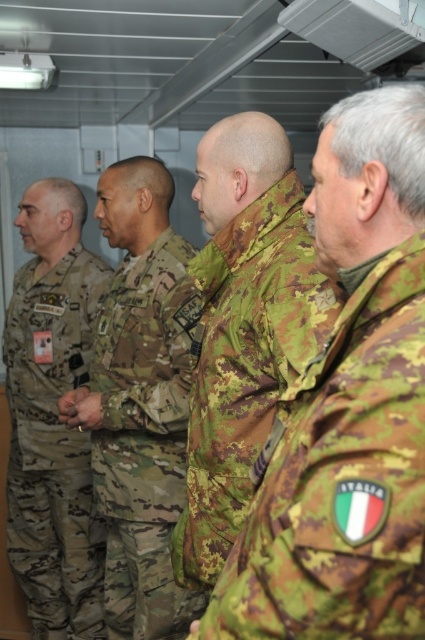
You are a photographer trying to capture a clear photo of the camouflage uniform at center and the camouflage fabric jacket at center. Since both are at the center, which one is blocking the view of the other?

The camouflage fabric jacket at center is behind camouflage uniform at center, so the camouflage uniform at center is blocking the view of the camouflage fabric jacket at center.

You are a photographer setting up a tripod to take a group photo of the four individuals. The tripod has a limited range and can only focus on objects within a 0.5 unit radius centered at point 0.5, 0.5. Will the camouflage fabric jacket at center be within the focus range of the tripod?

The camouflage fabric jacket at center is located at point (237, 326). The distance from the center point (212, 320) to this location is calculated using the Euclidean distance formula. The difference in the x coordinates is 0.012, and the difference in the y coordinates is 0.058. Squaring these differences gives 0.000144 and 0.003364 respectively. Adding them together results in 0.003508, and taking the square root gives approximately 0.0592 units. Since this distance is less than 0.5 units, the camouflage